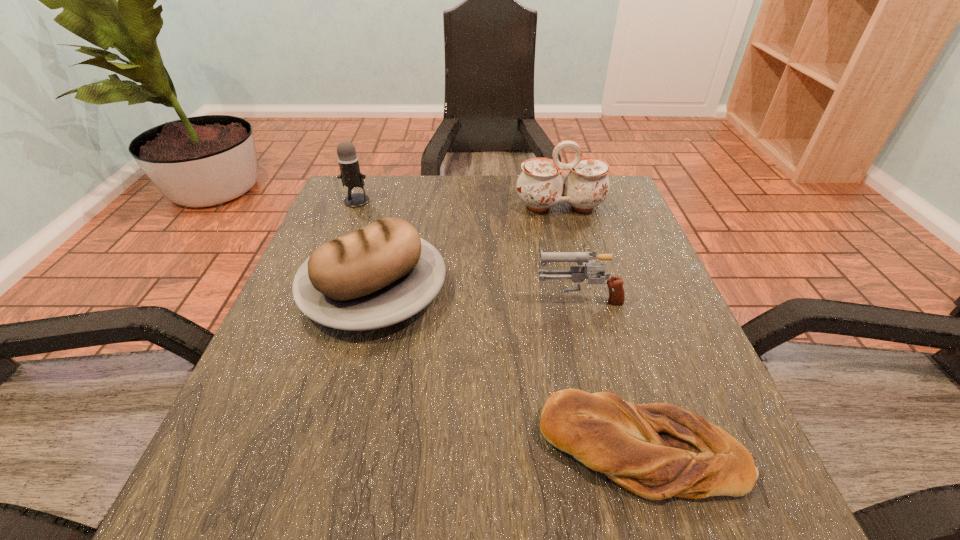
This screenshot has width=960, height=540. In order to click on vacant area between the microphone and the gun in this screenshot , I will do `click(468, 249)`.

Choose which object is the third nearest neighbor to the gun. Please provide its 2D coordinates. Your answer should be formatted as a tuple, i.e. [(x, y)], where the tuple contains the x and y coordinates of a point satisfying the conditions above.

[(540, 186)]

Locate which object ranks third in proximity to the right bread. Please provide its 2D coordinates. Your answer should be formatted as a tuple, i.e. [(x, y)], where the tuple contains the x and y coordinates of a point satisfying the conditions above.

[(540, 186)]

At what (x,y) coordinates should I click in order to perform the action: click on vacant space that satisfies the following two spatial constraints: 1. at the barrel end of the gun; 2. on the right side of the nearest object. Please return your answer as a coordinate pair (x, y). This screenshot has width=960, height=540. Looking at the image, I should click on (614, 448).

Identify the location of vacant area that satisfies the following two spatial constraints: 1. by the handle of the chinaware; 2. on the left side of the nearest object. (622, 448).